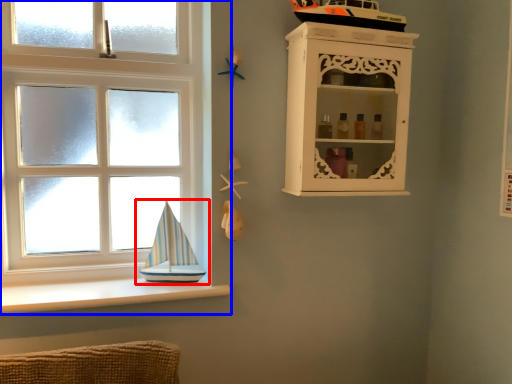
Question: Which point is further to the camera, boat (highlighted by a red box) or window (highlighted by a blue box)?

Choices:
 (A) boat
 (B) window

Answer: (A)